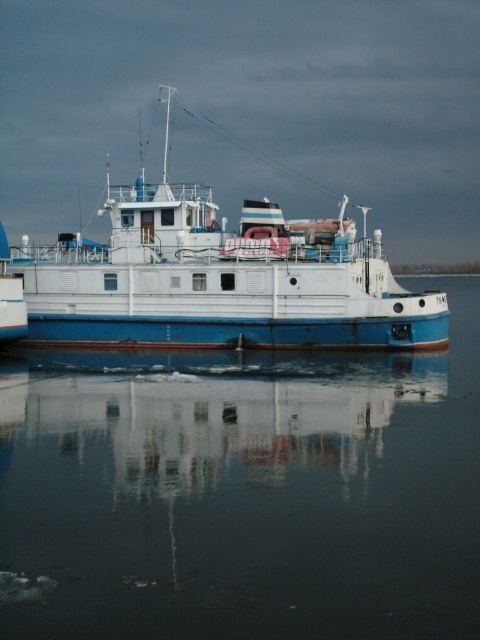
You are on a boat trip and need to know the direction of the water surface relative to the boat. According to the scene, is the smooth water at center located to the left or right of the white matte boat at center?

The smooth water at center is to the left of the white matte boat at center.

You are standing on the dock and looking at the smooth water at center and the white matte boat at center. Which object is lower in height?

The smooth water at center has a lesser height compared to the white matte boat at center, so the smooth water at center is lower in height.